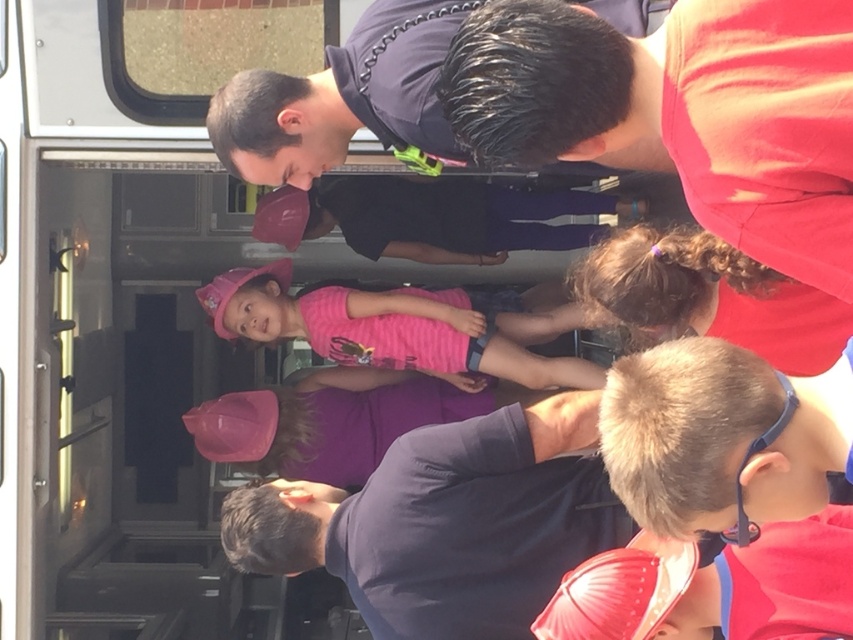
Can you confirm if pink fabric shirt at center is smaller than purple matte shirt at center?

No, pink fabric shirt at center is not smaller than purple matte shirt at center.

The image size is (853, 640). Identify the location of pink fabric shirt at center. (395, 328).

Between point (276, 296) and point (357, 451), which one is positioned behind?

Point (276, 296)

Locate an element on the screen. pink fabric shirt at center is located at coordinates (395, 328).

Is point (599, 122) positioned before point (431, 81)?

That is True.

Where is `red matte shirt at upper right`? red matte shirt at upper right is located at coordinates pyautogui.click(x=682, y=112).

Locate an element on the screen. This screenshot has height=640, width=853. red matte shirt at upper right is located at coordinates (682, 112).

Is pink fabric at center to the right of purple matte shirt at center from the viewer's perspective?

Correct, you'll find pink fabric at center to the right of purple matte shirt at center.

Can you confirm if pink fabric at center is bigger than purple matte shirt at center?

Yes.

The height and width of the screenshot is (640, 853). What do you see at coordinates (433, 218) in the screenshot?
I see `pink fabric at center` at bounding box center [433, 218].

Locate an element on the screen. This screenshot has width=853, height=640. pink fabric at center is located at coordinates (433, 218).